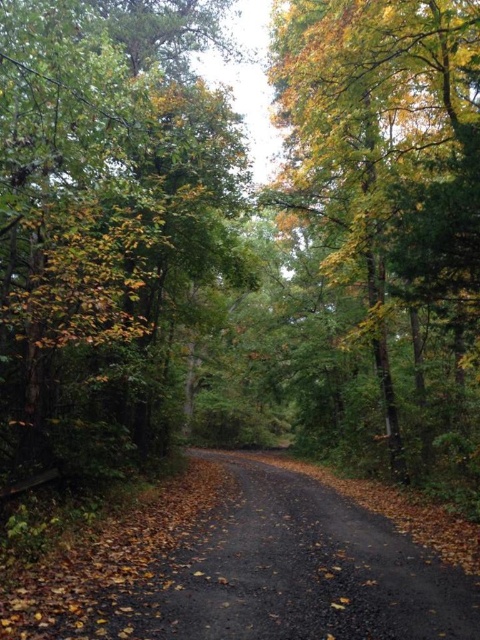
You are standing on the black asphalt road at center and want to see the top of the green matte tree at center. Can you see the top of the tree from your current position?

The green matte tree at center is taller than the black asphalt road at center, so yes, you can see the top of the green matte tree at center from your current position on the black asphalt road at center.

You are standing on the dirt path in the forest and want to take a photo of both the green matte tree at center and the green leafy tree at upper right. Which tree should you focus on first to ensure both are in clear view?

You should focus on the green matte tree at center first because it is closer to you than the green leafy tree at upper right, so adjusting focus from near to far will help capture both clearly.

You are a hiker who wants to take a photo of the green leafy tree at upper right without the black asphalt road at center appearing in the background. Is it possible to do so from your current position?

The green leafy tree at upper right is positioned over the black asphalt road at center, so it is not possible to capture the tree without the road in the background from your current position.